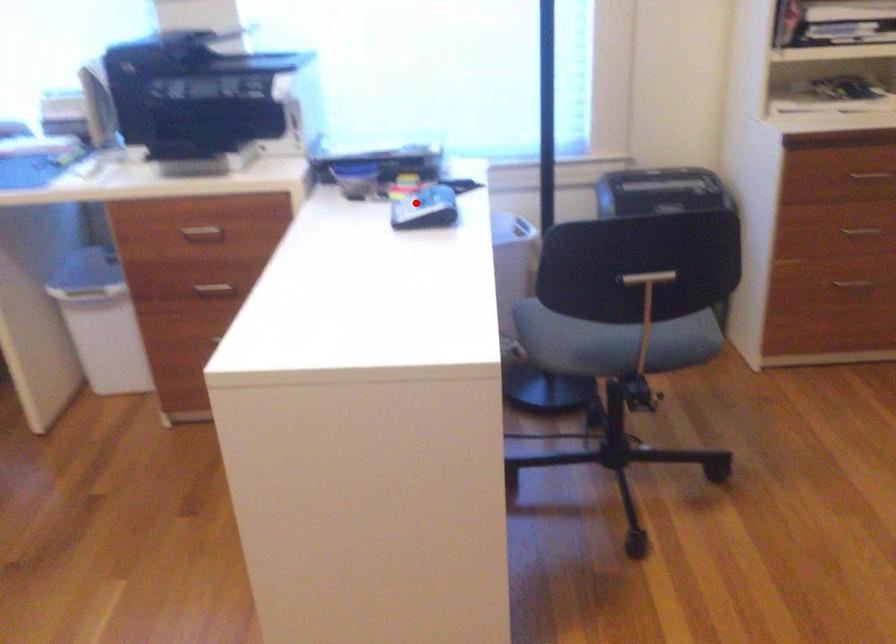
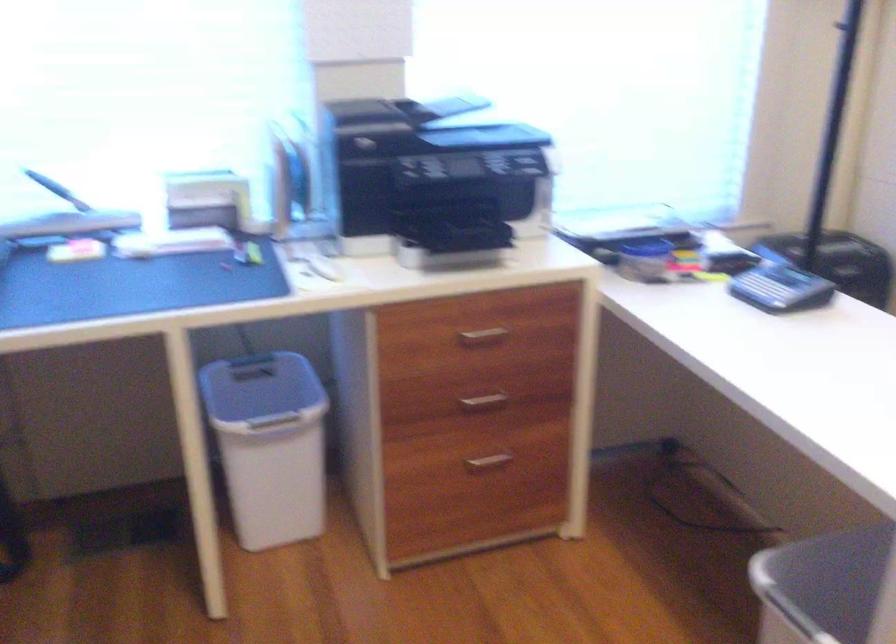
The point at the highlighted location is marked in the first image. Where is the corresponding point in the second image?

(763, 289)